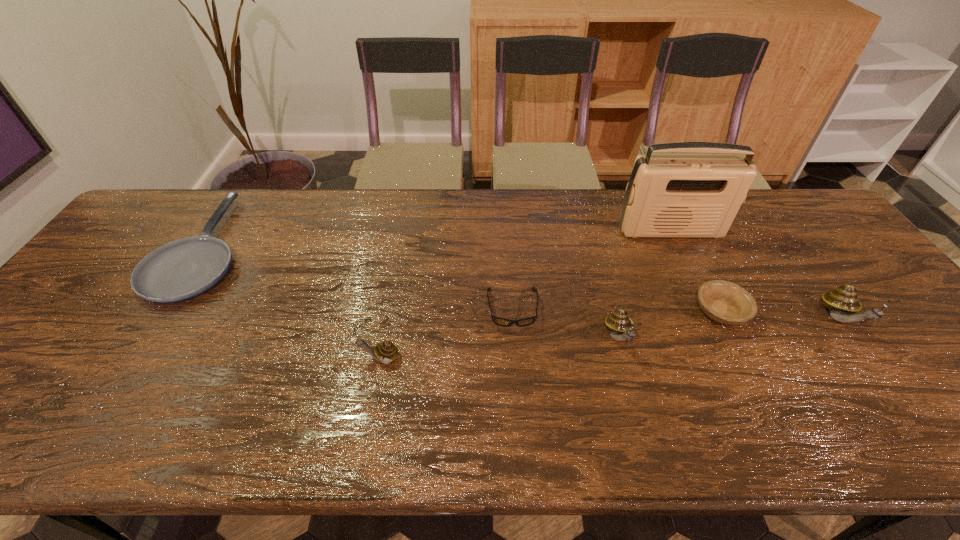
Where is `frying pan that is at the far edge`? This screenshot has height=540, width=960. frying pan that is at the far edge is located at coordinates (184, 268).

This screenshot has width=960, height=540. In order to click on object that is at the left edge in this screenshot , I will do `click(184, 268)`.

The image size is (960, 540). Identify the location of object that is at the right edge. (843, 304).

Find the location of a particular element. object situated at the far left corner is located at coordinates (184, 268).

Identify the location of free space at the far edge of the desktop. Image resolution: width=960 pixels, height=540 pixels. (448, 212).

Where is `vacant area at the near edge`? The image size is (960, 540). vacant area at the near edge is located at coordinates (720, 378).

You are a GUI agent. You are given a task and a screenshot of the screen. Output one action in this format:
    pyautogui.click(x=<x>, y=<y>)
    Task: Click on the free space at the left edge
    
    Given the screenshot: What is the action you would take?
    pyautogui.click(x=73, y=345)

Image resolution: width=960 pixels, height=540 pixels. Identify the location of free space at the right edge. (836, 251).

Find the location of a particular element. The image size is (960, 540). vacant space at the near left corner of the desktop is located at coordinates (49, 387).

Locate an element on the screen. vacant space at the far right corner of the desktop is located at coordinates (763, 190).